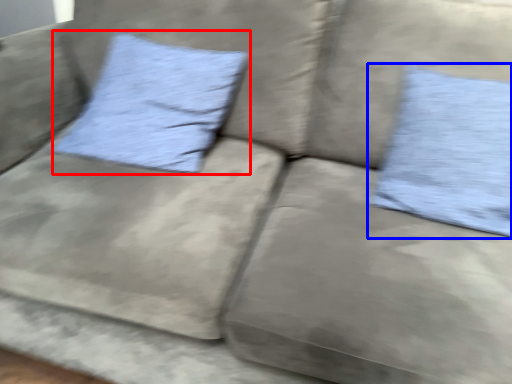
Question: Among these objects, which one is farthest to the camera, pillow (highlighted by a red box) or pillow (highlighted by a blue box)?

Choices:
 (A) pillow
 (B) pillow

Answer: (A)